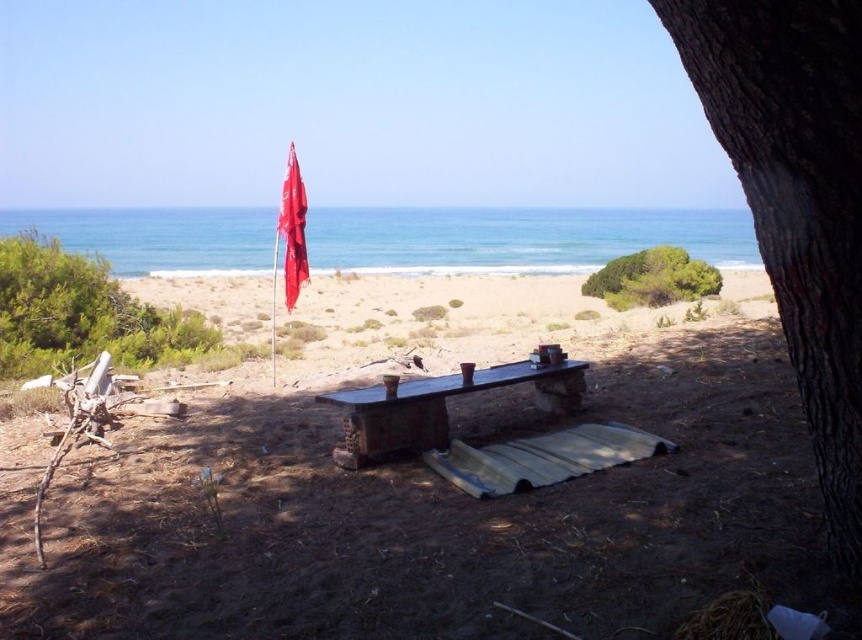
Question: Is brown dirt at center thinner than red fabric flag at upper center?

Choices:
 (A) yes
 (B) no

Answer: (A)

Question: Among these objects, which one is nearest to the camera?

Choices:
 (A) green leafy bush at left
 (B) brown rough bark tree at right
 (C) brown sandy beach at center
 (D) brown dirt at center

Answer: (B)

Question: Which object appears closest to the camera in this image?

Choices:
 (A) green leafy bush at center
 (B) brown sandy beach at center
 (C) wooden bench at center

Answer: (C)

Question: Considering the real-world distances, which object is farthest from the brown rough bark tree at right?

Choices:
 (A) brown sandy beach at center
 (B) red fabric flag at upper center
 (C) green leafy bush at left
 (D) brown dirt at center

Answer: (A)

Question: Is brown dirt at center to the left of wooden bench at center from the viewer's perspective?

Choices:
 (A) yes
 (B) no

Answer: (A)

Question: Can you confirm if wooden bench at center is bigger than red fabric flag at upper center?

Choices:
 (A) no
 (B) yes

Answer: (A)